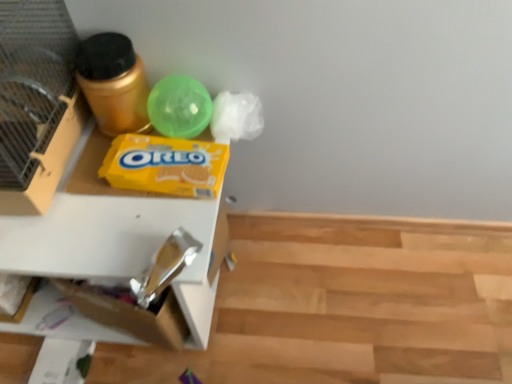
The height and width of the screenshot is (384, 512). I want to click on vacant point to the right of white cardboard drawer at left, so click(324, 296).